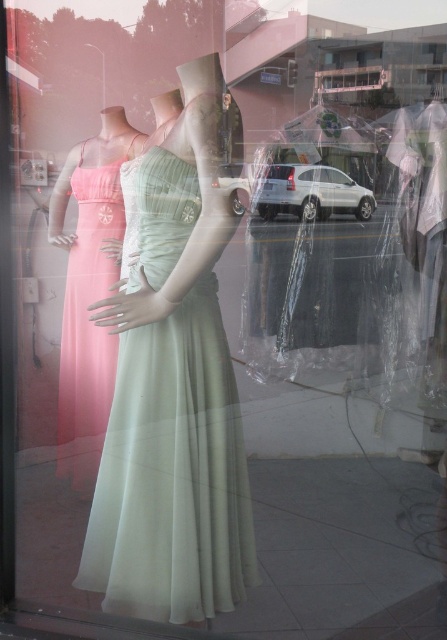
Is satin pale green dress at center to the right of matte pink fabric dress at left from the viewer's perspective?

Yes, satin pale green dress at center is to the right of matte pink fabric dress at left.

Which is in front, point (161, 262) or point (83, 458)?

Point (161, 262) is more forward.

Locate an element on the screen. The height and width of the screenshot is (640, 447). satin pale green dress at center is located at coordinates (172, 474).